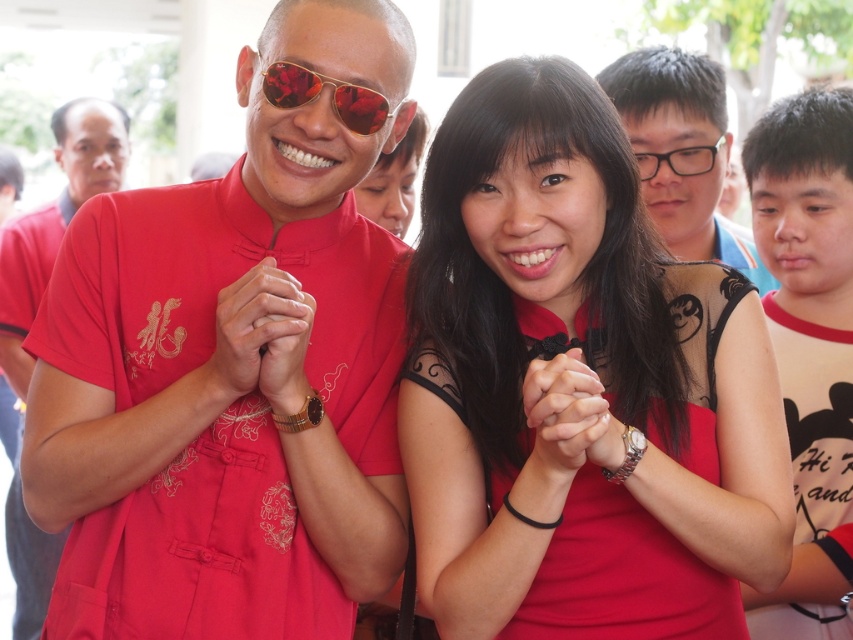
Question: Observing the image, what is the correct spatial positioning of matte red shirt at left in reference to shiny red sunglasses at center?

Choices:
 (A) above
 (B) below

Answer: (A)

Question: Which point appears closest to the camera in this image?

Choices:
 (A) (282, 104)
 (B) (645, 154)

Answer: (A)

Question: Does matte black glasses at upper center appear on the left side of shiny red sunglasses at center?

Choices:
 (A) no
 (B) yes

Answer: (A)

Question: Among these points, which one is farthest from the camera?

Choices:
 (A) (819, 625)
 (B) (178, 500)
 (C) (618, 92)
 (D) (596, 243)

Answer: (C)

Question: Which point is closer to the camera taking this photo?

Choices:
 (A) (364, 96)
 (B) (381, 492)

Answer: (A)

Question: Is matte black glasses at upper center positioned in front of shiny red sunglasses at center?

Choices:
 (A) no
 (B) yes

Answer: (A)